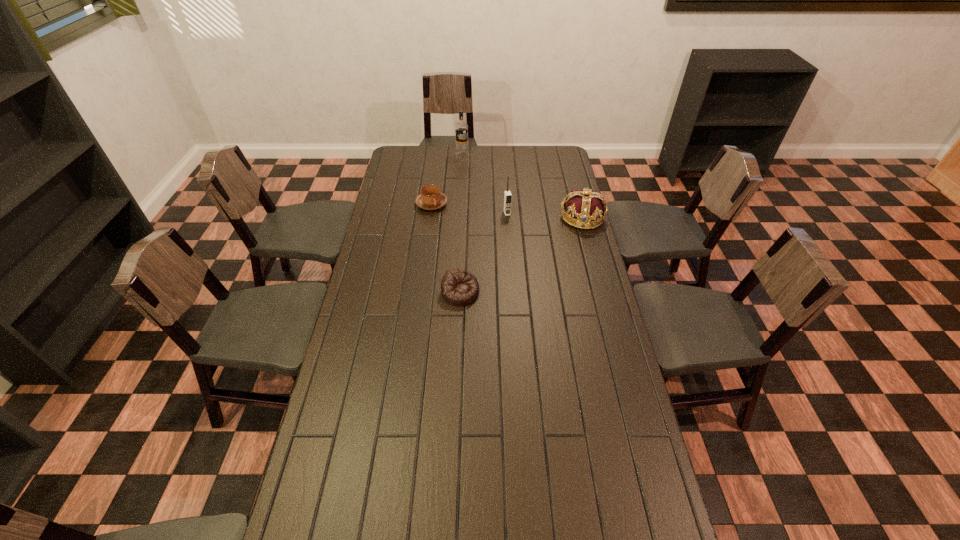
Image resolution: width=960 pixels, height=540 pixels. Identify the location of empty space between the nearest object and the vodka. (462, 224).

Locate an element on the screen. free area in between the leftmost object and the beanbag is located at coordinates (446, 248).

Where is `vacant space that's between the third shortest object and the vodka`? Image resolution: width=960 pixels, height=540 pixels. vacant space that's between the third shortest object and the vodka is located at coordinates (522, 186).

The height and width of the screenshot is (540, 960). In order to click on unoccupied area between the cappuccino and the tallest object in this screenshot , I will do `click(447, 179)`.

Identify the location of vacant region between the beanbag and the cappuccino. (446, 248).

The height and width of the screenshot is (540, 960). I want to click on vacant area that lies between the leftmost object and the cellular telephone, so click(x=469, y=208).

Choose which object is the third nearest neighbor to the third shortest object. Please provide its 2D coordinates. Your answer should be formatted as a tuple, i.e. [(x, y)], where the tuple contains the x and y coordinates of a point satisfying the conditions above.

[(431, 198)]

Where is `object that is the third closest to the nearest object`? This screenshot has height=540, width=960. object that is the third closest to the nearest object is located at coordinates point(586,207).

Image resolution: width=960 pixels, height=540 pixels. I want to click on free space that satisfies the following two spatial constraints: 1. on the front side of the beanbag; 2. on the left side of the leftmost object, so click(x=420, y=292).

Where is `vacant position in the image that satisfies the following two spatial constraints: 1. on the back side of the nearest object; 2. on the left side of the second tallest object`? vacant position in the image that satisfies the following two spatial constraints: 1. on the back side of the nearest object; 2. on the left side of the second tallest object is located at coordinates (464, 213).